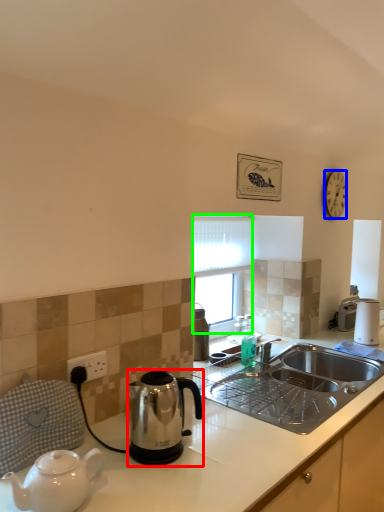
Question: Estimate the real-world distances between objects in this image. Which object is farther from kettle (highlighted by a red box), clock (highlighted by a blue box) or window screen (highlighted by a green box)?

Choices:
 (A) clock
 (B) window screen

Answer: (A)